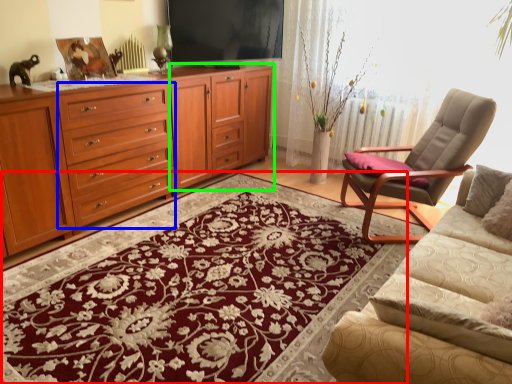
Question: Which object is positioned farthest from mat (highlighted by a red box)? Select from drawer (highlighted by a blue box) and tv cabinet (highlighted by a green box).

Choices:
 (A) drawer
 (B) tv cabinet

Answer: (B)